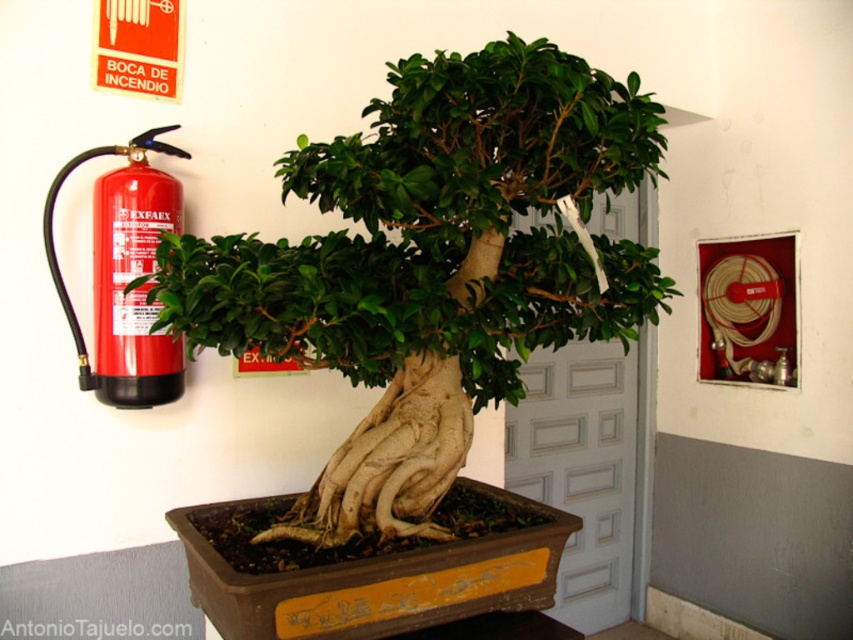
You are a firefighter inspecting the room. You see the green matte bonsai tree at center and the red matte fire extinguisher at left. Which object is taller?

The green matte bonsai tree at center is taller than the red matte fire extinguisher at left.

You are standing in front of the bonsai tree in the rectangular pot. You notice two points marked on the wall. The first point is at coordinates point (497, 374) and the second point is at coordinates point (123, 291). From your perspective, which point is closer to you?

Point (123, 291) is closer to you because it is in front of point (497, 374).